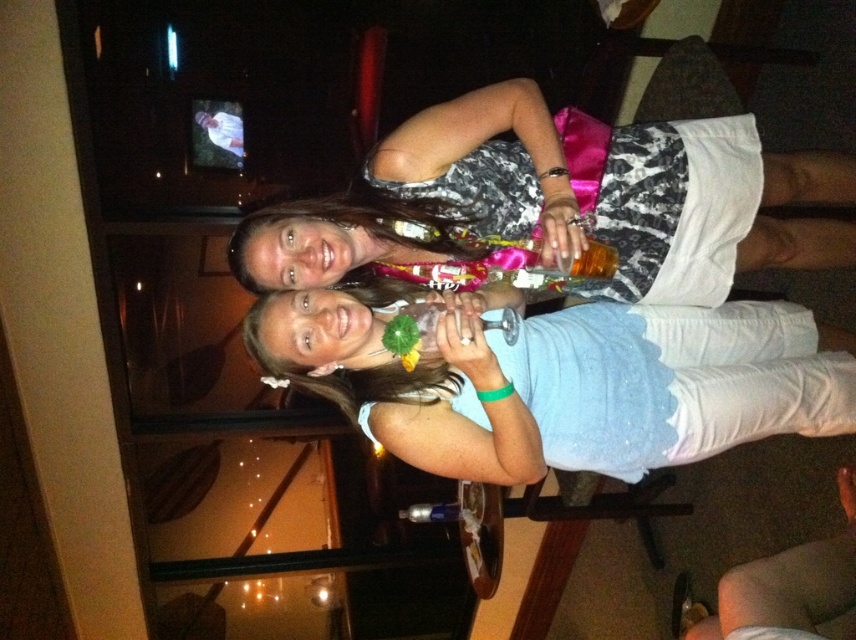
You are a photographer at a party and need to adjust the lighting so that both the white matte dress at center and the matte black dress at center are equally visible. Which dress should you focus on adjusting the lighting for, and why?

You should focus on adjusting the lighting for the matte black dress at center because it is darker in color and located above the white matte dress at center, which might require more light to ensure it stands out and is visible.

You are a photographer at a party and need to position two guests wearing the white matte dress at center and the matte black dress at center so that both can fit comfortably in the frame. Based on their dress widths, which dress should be placed closer to the edge of the frame to ensure they both fit?

The white matte dress at center has a lesser width compared to the matte black dress at center, so the wider matte black dress at center should be placed closer to the center of the frame, while the narrower white matte dress at center can be positioned closer to the edge to ensure both fit comfortably.